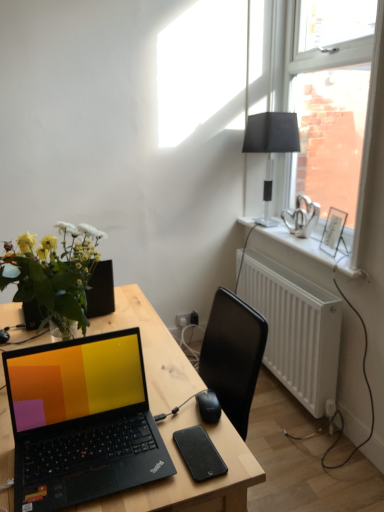
Where is `vacant space behind black plastic mouse at center`? The height and width of the screenshot is (512, 384). vacant space behind black plastic mouse at center is located at coordinates (179, 375).